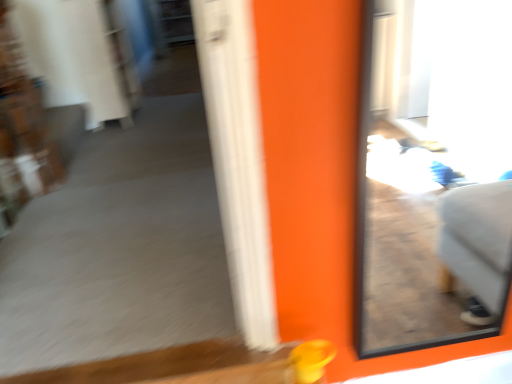
Locate an element on the screen. transparent glass window at upper right is located at coordinates tap(433, 173).

Image resolution: width=512 pixels, height=384 pixels. What do you see at coordinates (433, 173) in the screenshot? I see `transparent glass window at upper right` at bounding box center [433, 173].

You are a GUI agent. You are given a task and a screenshot of the screen. Output one action in this format:
    pyautogui.click(x=<x>, y=<y>)
    Task: Click on the transparent glass window at upper right
    The image size is (512, 384).
    Given the screenshot: What is the action you would take?
    pyautogui.click(x=433, y=173)